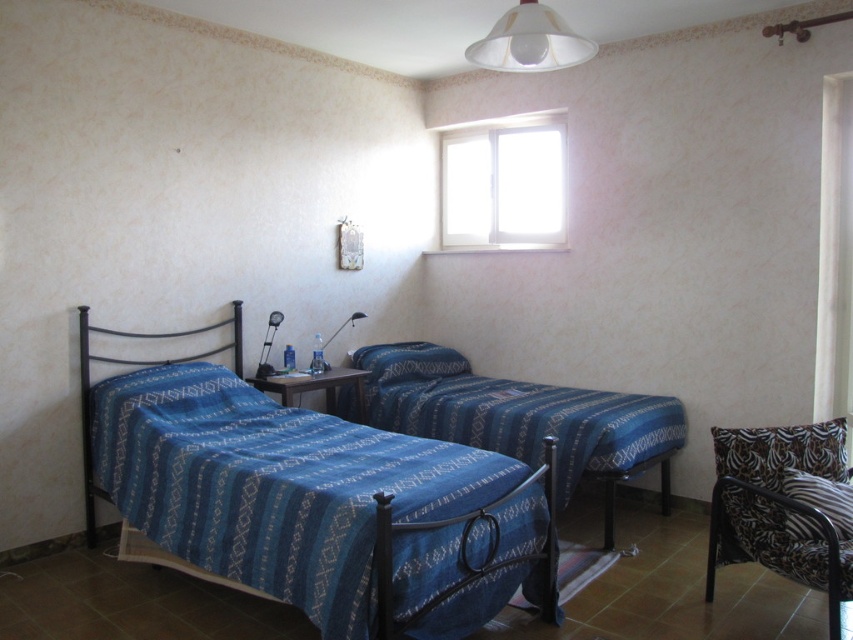
You are a delivery person trying to place a package between the two blue woven fabric bed at center. The package is 3 meters long. Will it fit in the space between them?

The distance between the two blue woven fabric bed at center is 3.58 meters, so the 3 meters long package will fit in the space between them.

You are trying to place a 4 feet long ladder in the room. You want to place it between the blue woven fabric bed at center and the metallic black lamp at center. Is there enough space between them to fit the ladder?

The blue woven fabric bed at center and metallic black lamp at center are 3.85 feet apart, so the ladder is 4 feet long which is slightly longer than the space between them. Therefore, the ladder cannot fit between them.